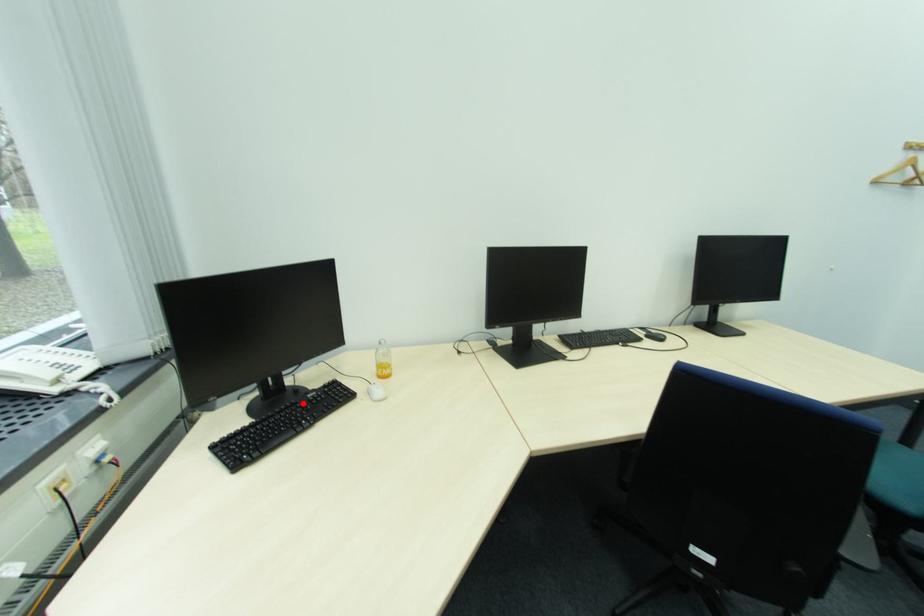
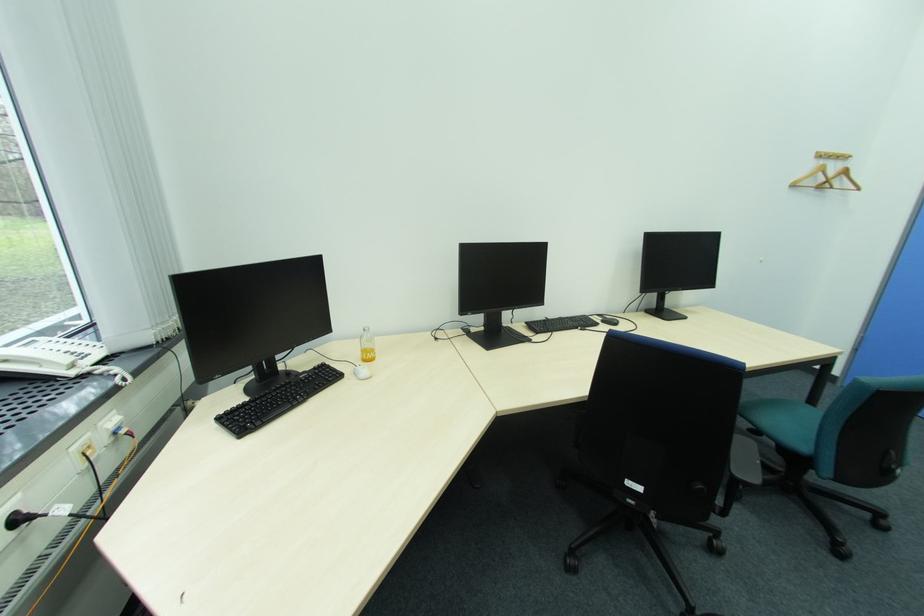
Find the pixel in the second image that matches the highlighted location in the first image.

(297, 383)